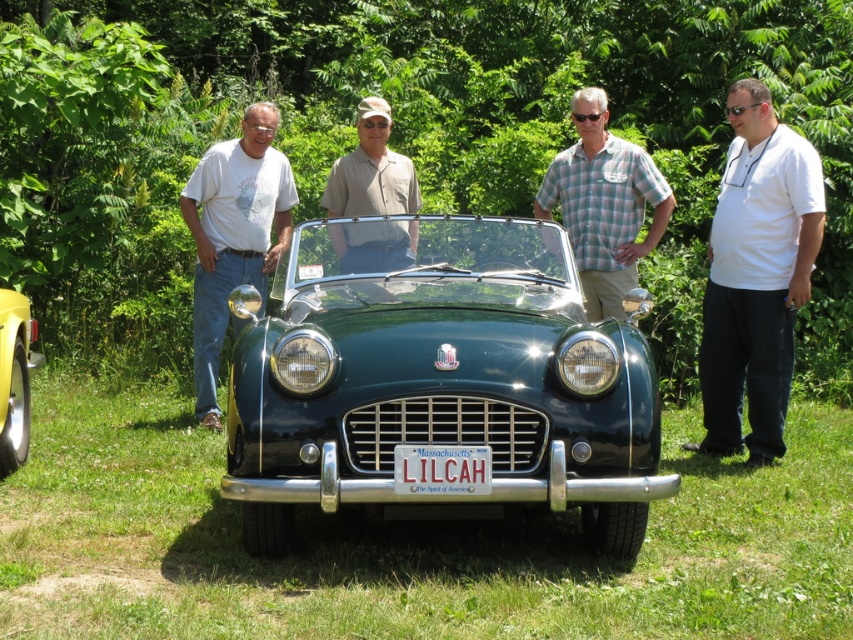
Question: Is yellow matte car at lower left below white plastic license plate at center?

Choices:
 (A) yes
 (B) no

Answer: (B)

Question: Is green metallic car at center positioned behind white matte t-shirt at left?

Choices:
 (A) no
 (B) yes

Answer: (A)

Question: Which point is farther from the camera taking this photo?

Choices:
 (A) (480, 333)
 (B) (355, 196)

Answer: (B)

Question: Estimate the real-world distances between objects in this image. Which object is farther from the white smooth shirt at center?

Choices:
 (A) plaid shirt at center
 (B) white plastic license plate at center

Answer: (B)

Question: Which point is farther to the camera?

Choices:
 (A) white smooth shirt at center
 (B) white plastic license plate at center
 (C) yellow matte car at lower left

Answer: (A)

Question: Does plaid shirt at center appear over yellow matte car at lower left?

Choices:
 (A) yes
 (B) no

Answer: (A)